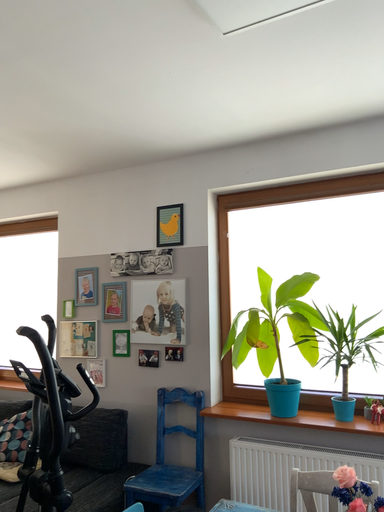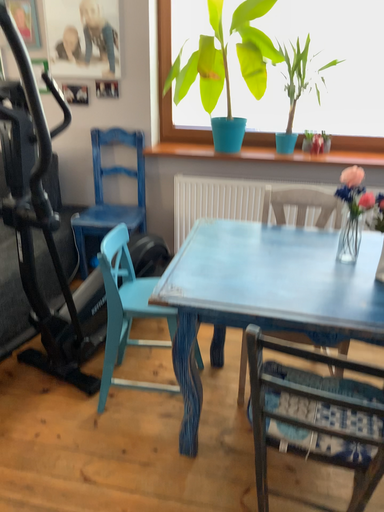
Question: How did the camera likely rotate when shooting the video?

Choices:
 (A) rotated upward
 (B) rotated downward

Answer: (B)